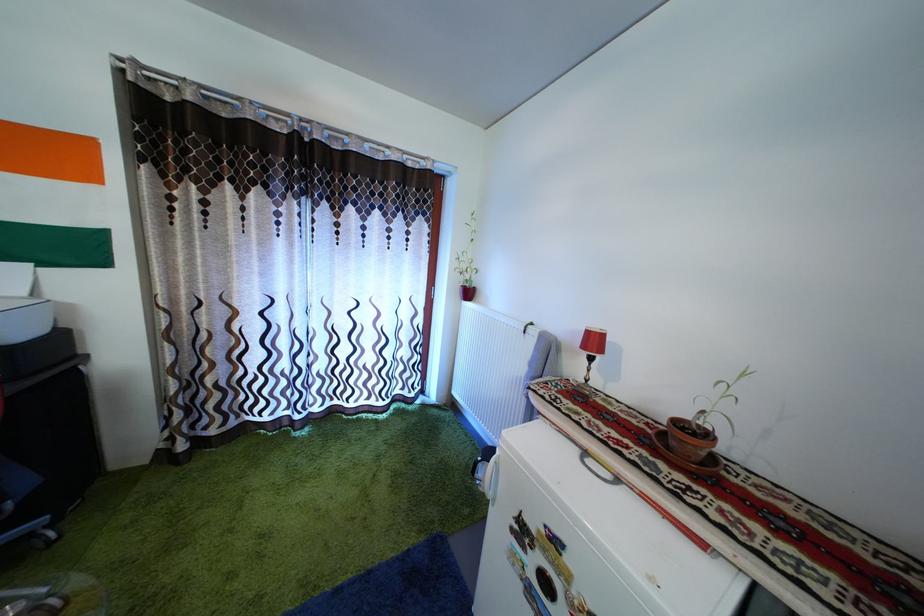
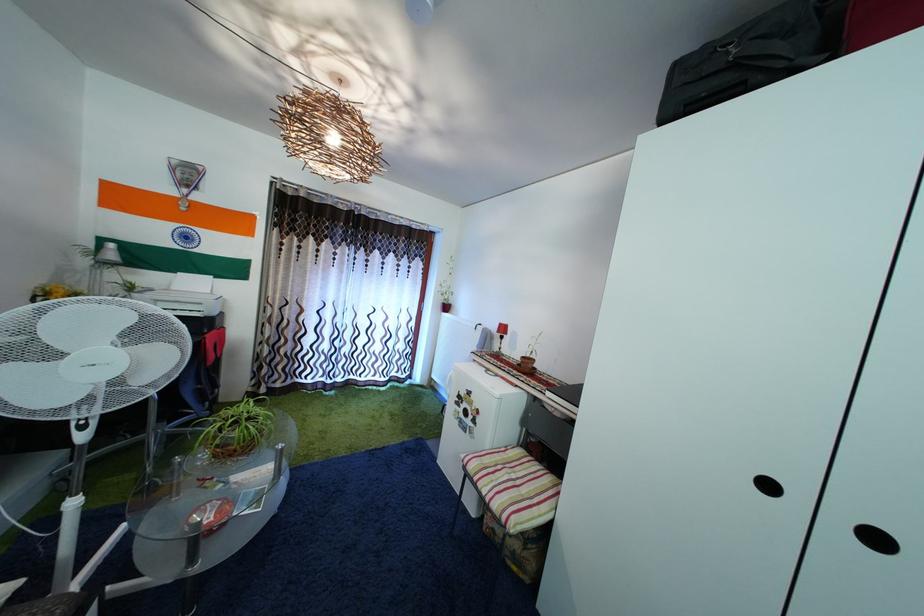
Where in the second image is the point corresponding to (x=344, y=408) from the first image?

(359, 384)